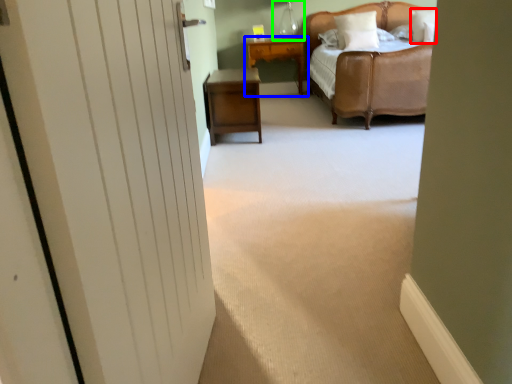
Question: Considering the real-world distances, which object is farthest from pillow (highlighted by a red box)? nightstand (highlighted by a blue box) or table lamp (highlighted by a green box)?

Choices:
 (A) nightstand
 (B) table lamp

Answer: (B)